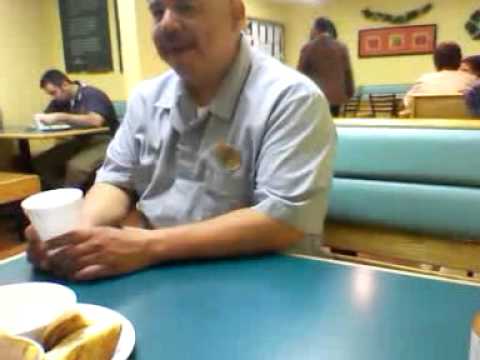
I want to click on blue seat cushions back of seat, so click(x=411, y=148), click(x=366, y=150), click(x=360, y=202), click(x=446, y=213), click(x=120, y=106).